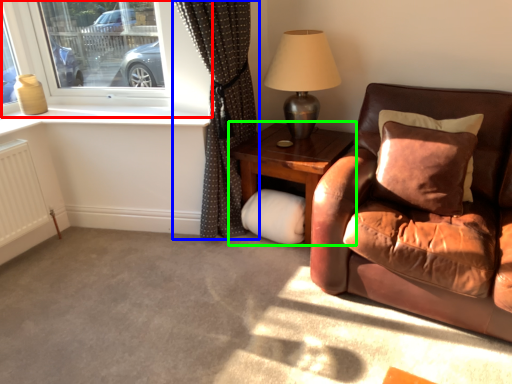
Question: Which object is the closest to the window (highlighted by a red box)? Choose among these: curtain (highlighted by a blue box) or table (highlighted by a green box).

Choices:
 (A) curtain
 (B) table

Answer: (A)